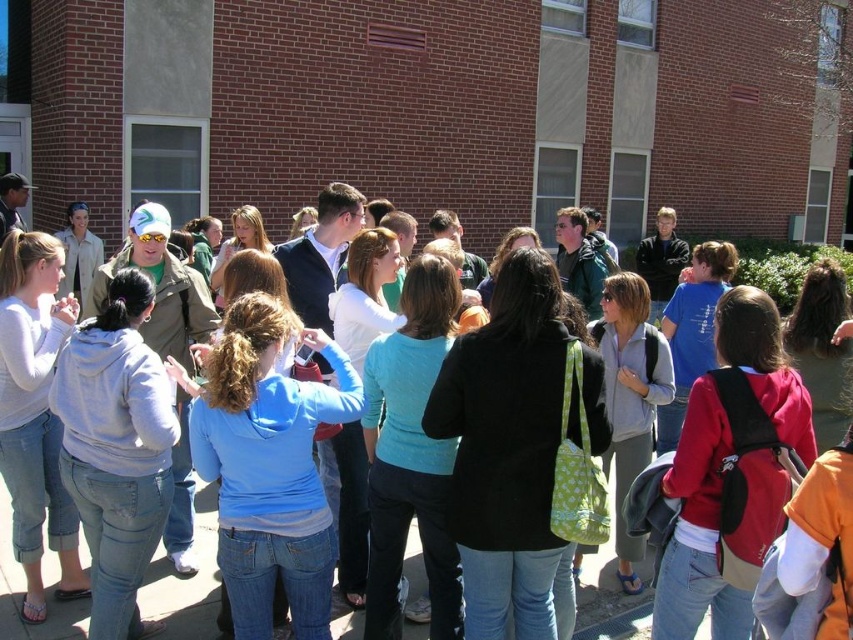
You are standing at the center of the image and want to locate the blue fleece jacket at center. Which direction should you look to find it?

The blue fleece jacket at center is located at point coordinates (270, 467), so you should look towards the lower right direction from the center to find it.

You are a photographer trying to capture a group photo of the blue fleece jacket at center and the matte blue hoodie at center. Since you want to ensure both are fully visible, which clothing item should you adjust your camera angle to prioritize if one is wider than the other?

The blue fleece jacket at center might be wider than the matte blue hoodie at center, so you should adjust the camera angle to prioritize capturing the blue fleece jacket at center to ensure it fits within the frame.